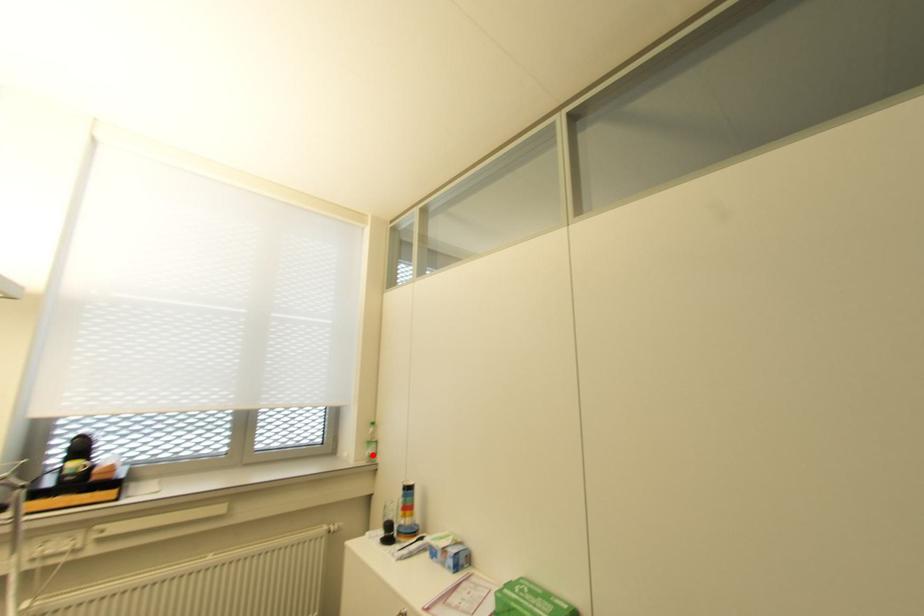
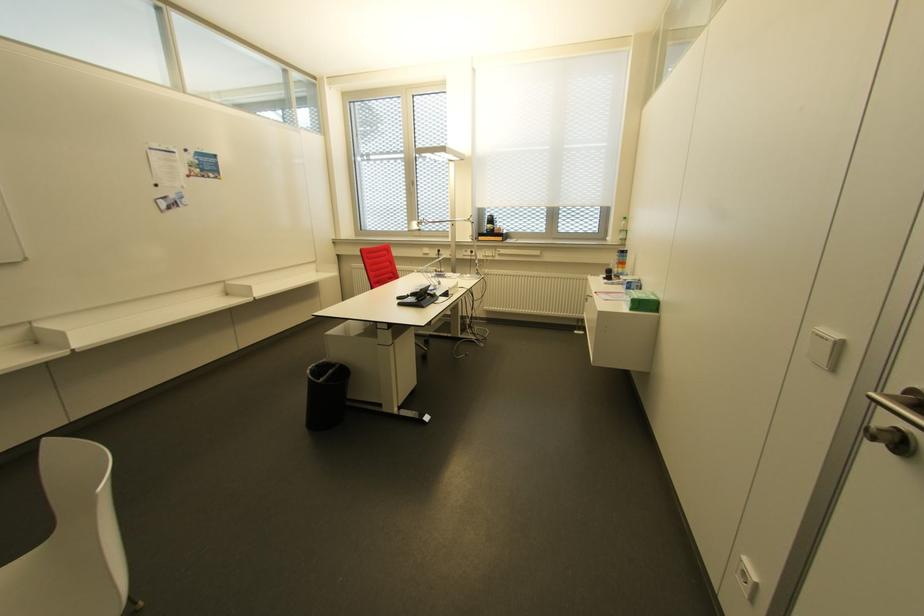
Question: A red point is marked in image1. In image2, is the corresponding 3D point closer to the camera or farther? Reply with the corresponding letter.

Choices:
 (A) The corresponding 3D point is closer.
 (B) The corresponding 3D point is farther.

Answer: (A)